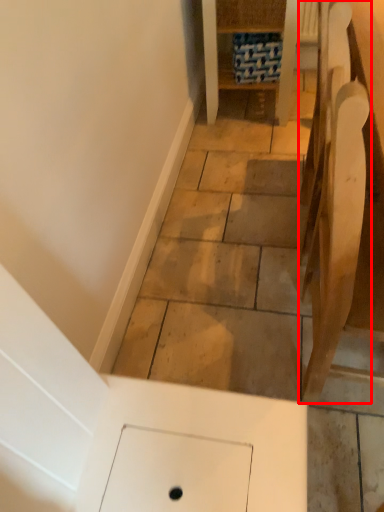
Question: In this image, where is furniture (annotated by the red box) located relative to furniture?

Choices:
 (A) left
 (B) right

Answer: (B)